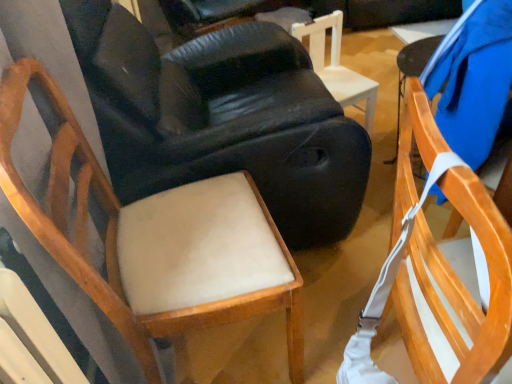
Question: From the image's perspective, is wooden chair with white straps at right, the first chair positioned from the right, positioned above or below light beige fabric chair at center, which is the 2th chair in left-to-right order?

Choices:
 (A) above
 (B) below

Answer: (B)

Question: From a real-world perspective, is wooden chair with white straps at right, the fourth chair viewed from the left, above or below light beige fabric chair at center, which is the 2th chair in left-to-right order?

Choices:
 (A) above
 (B) below

Answer: (B)

Question: Which object is the farthest from the white wood chair at center, marked as the second chair in a right-to-left arrangement?

Choices:
 (A) wooden chair with white straps at right, the first chair positioned from the right
 (B) light brown wood chair at left, which appears as the 4th chair when viewed from the right
 (C) light beige fabric chair at center, the third chair when ordered from right to left

Answer: (A)

Question: Which object is the farthest from the wooden chair with white straps at right, the fourth chair viewed from the left?

Choices:
 (A) light beige fabric chair at center, the third chair when ordered from right to left
 (B) white wood chair at center, marked as the second chair in a right-to-left arrangement
 (C) light brown wood chair at left, which appears as the 4th chair when viewed from the right

Answer: (B)